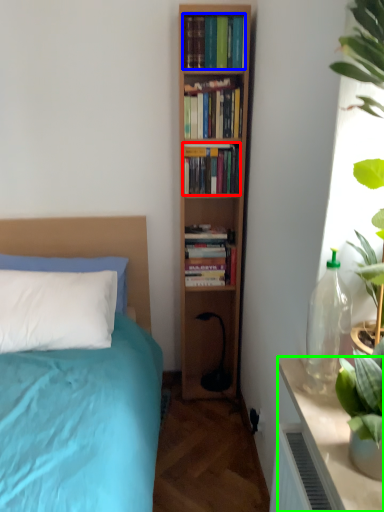
Question: Which object is the farthest from book (highlighted by a red box)? Choose among these: book (highlighted by a blue box) or table (highlighted by a green box).

Choices:
 (A) book
 (B) table

Answer: (B)